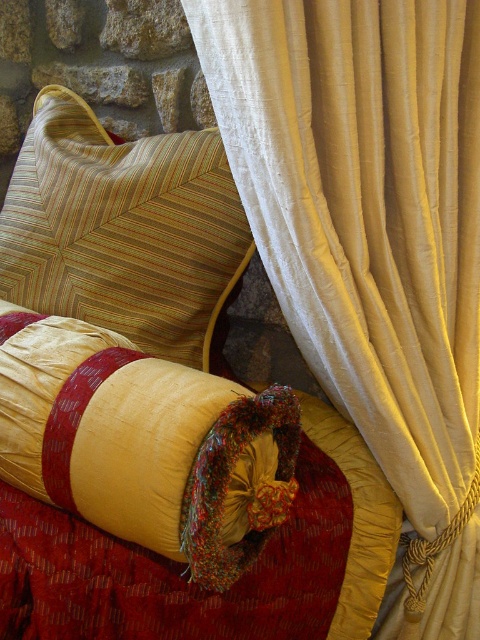
Question: Which of the following is the closest to the observer?

Choices:
 (A) velvet gold throw pillow at center
 (B) silky cream curtain at upper right
 (C) striped fabric cushion at upper left

Answer: (A)

Question: Can you confirm if silky cream curtain at upper right is bigger than striped fabric cushion at upper left?

Choices:
 (A) yes
 (B) no

Answer: (A)

Question: Which point appears farthest from the camera in this image?

Choices:
 (A) (427, 240)
 (B) (118, 253)

Answer: (B)

Question: Is silky cream curtain at upper right wider than velvet gold throw pillow at center?

Choices:
 (A) no
 (B) yes

Answer: (A)

Question: Among these objects, which one is farthest from the camera?

Choices:
 (A) velvet gold throw pillow at center
 (B) silky cream curtain at upper right

Answer: (B)

Question: Is velvet gold throw pillow at center above striped fabric cushion at upper left?

Choices:
 (A) yes
 (B) no

Answer: (B)